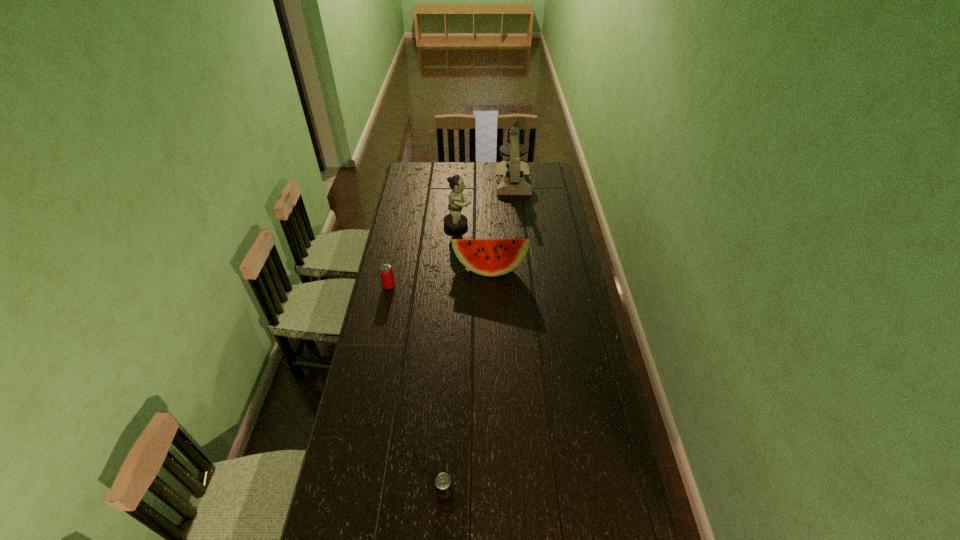
At what (x,y) coordinates should I click in order to perform the action: click on free space at the left edge. Please return your answer as a coordinate pair (x, y). Looking at the image, I should click on (368, 409).

At what (x,y) coordinates should I click in order to perform the action: click on free space at the right edge. Please return your answer as a coordinate pair (x, y). Looking at the image, I should click on (574, 261).

At what (x,y) coordinates should I click in order to perform the action: click on vacant position at the far left corner of the desktop. Please return your answer as a coordinate pair (x, y). The width and height of the screenshot is (960, 540). Looking at the image, I should click on (420, 176).

I want to click on free space between the leftmost object and the fourth nearest object, so click(x=423, y=255).

The height and width of the screenshot is (540, 960). Identify the location of empty space between the nearer beer can and the farthest object. [x=479, y=338].

The height and width of the screenshot is (540, 960). In order to click on free space between the third tallest object and the leftmost object in this screenshot , I will do `click(440, 277)`.

Locate an element on the screen. This screenshot has height=540, width=960. free space between the nearer beer can and the watermelon is located at coordinates (468, 382).

Locate an element on the screen. Image resolution: width=960 pixels, height=540 pixels. empty space between the second tallest object and the left beer can is located at coordinates (423, 255).

Identify the location of free space between the figurine and the nearest object. This screenshot has height=540, width=960. (451, 360).

Identify the location of empty space between the watermelon and the left beer can. This screenshot has height=540, width=960. (440, 277).